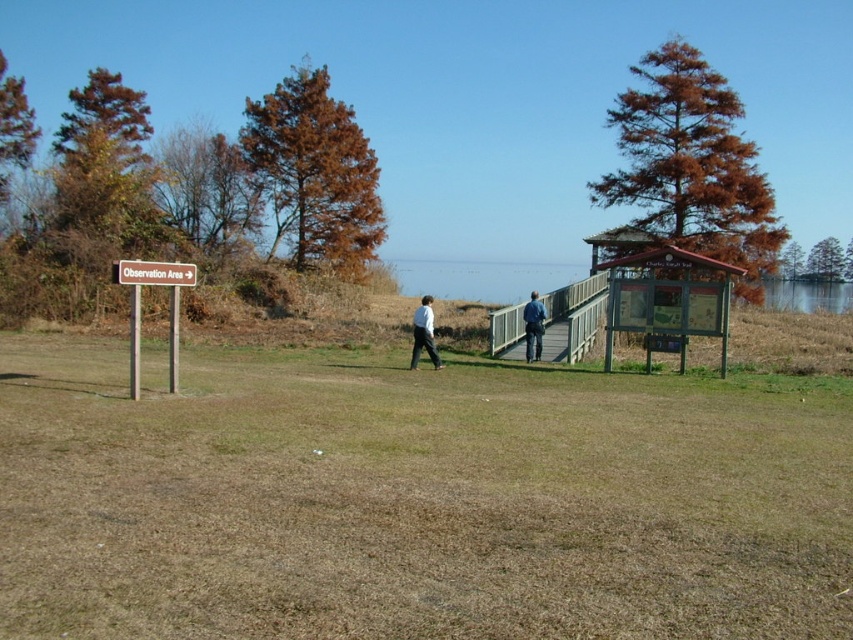
The height and width of the screenshot is (640, 853). What do you see at coordinates (138, 308) in the screenshot?
I see `brown wooden sign at left` at bounding box center [138, 308].

Which is below, brown wooden sign at left or white matte shirt at center?

white matte shirt at center is below.

Locate an element on the screen. This screenshot has height=640, width=853. brown wooden sign at left is located at coordinates (138, 308).

Can you confirm if white matte shirt at center is bigger than blue denim jeans at center?

Indeed, white matte shirt at center has a larger size compared to blue denim jeans at center.

Looking at this image, can you confirm if white matte shirt at center is positioned below blue denim jeans at center?

Incorrect, white matte shirt at center is not positioned below blue denim jeans at center.

Is point (422, 307) farther from viewer compared to point (538, 344)?

No, (422, 307) is closer to viewer.

Find the location of a particular element. Image resolution: width=853 pixels, height=640 pixels. white matte shirt at center is located at coordinates (422, 333).

Does brown dry grass at center come behind red wooden sign at upper left?

No.

Is brown dry grass at center taller than red wooden sign at upper left?

No.

Find the location of a particular element. This screenshot has height=640, width=853. brown dry grass at center is located at coordinates (415, 500).